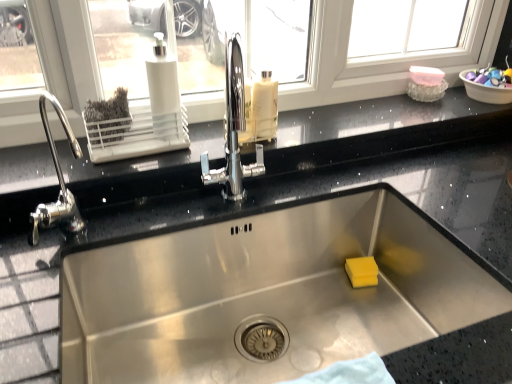
Question: From the image's perspective, is translucent plastic bottle at center located above or below white plastic soap dispenser at upper left?

Choices:
 (A) above
 (B) below

Answer: (A)

Question: From a real-world perspective, relative to white plastic soap dispenser at upper left, is translucent plastic bottle at center vertically above or below?

Choices:
 (A) below
 (B) above

Answer: (A)

Question: Considering the real-world distances, which object is farthest from the white plastic soap dispenser at upper left?

Choices:
 (A) plastic bowl at upper right
 (B) black granite countertop at upper center
 (C) translucent plastic bottle at center

Answer: (A)

Question: Considering the real-world distances, which object is farthest from the black granite countertop at upper center?

Choices:
 (A) plastic bowl at upper right
 (B) white plastic soap dispenser at upper left
 (C) translucent plastic bottle at center

Answer: (A)